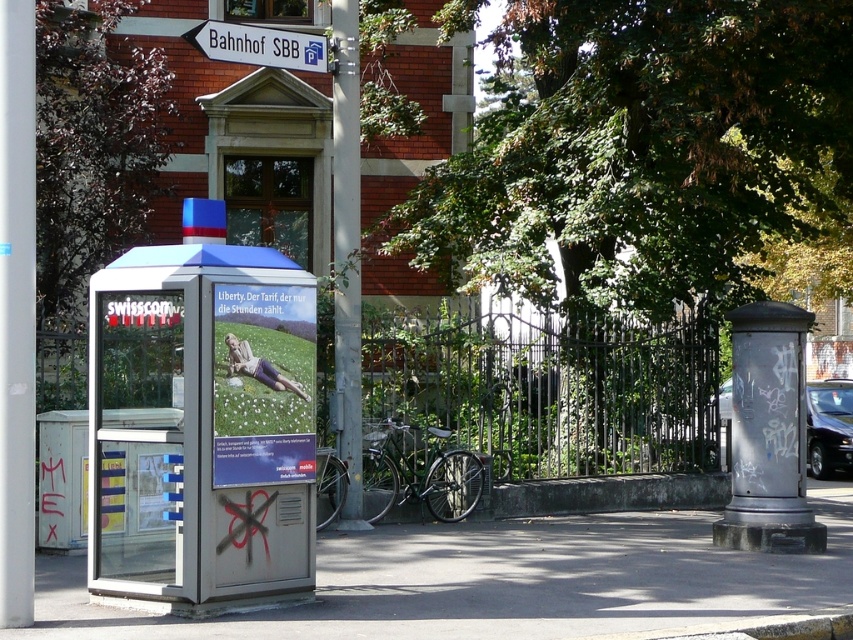
Question: Which of these objects is positioned farthest from the green wrought iron fence at center?

Choices:
 (A) metallic silver bus stop at left
 (B) concrete pavement at lower center
 (C) metallic gray pole at center

Answer: (B)

Question: Which point is closer to the camera?

Choices:
 (A) (426, 540)
 (B) (340, 419)
 (C) (143, 394)

Answer: (C)

Question: Which point is farther to the camera?

Choices:
 (A) (273, 54)
 (B) (718, 620)

Answer: (A)

Question: Does concrete pavement at lower center come in front of green wrought iron fence at center?

Choices:
 (A) yes
 (B) no

Answer: (A)

Question: Does metallic silver bus stop at left have a greater width compared to concrete pavement at lower center?

Choices:
 (A) no
 (B) yes

Answer: (B)

Question: Can you confirm if metallic silver bus stop at left is positioned above white plastic sign at upper center?

Choices:
 (A) yes
 (B) no

Answer: (B)